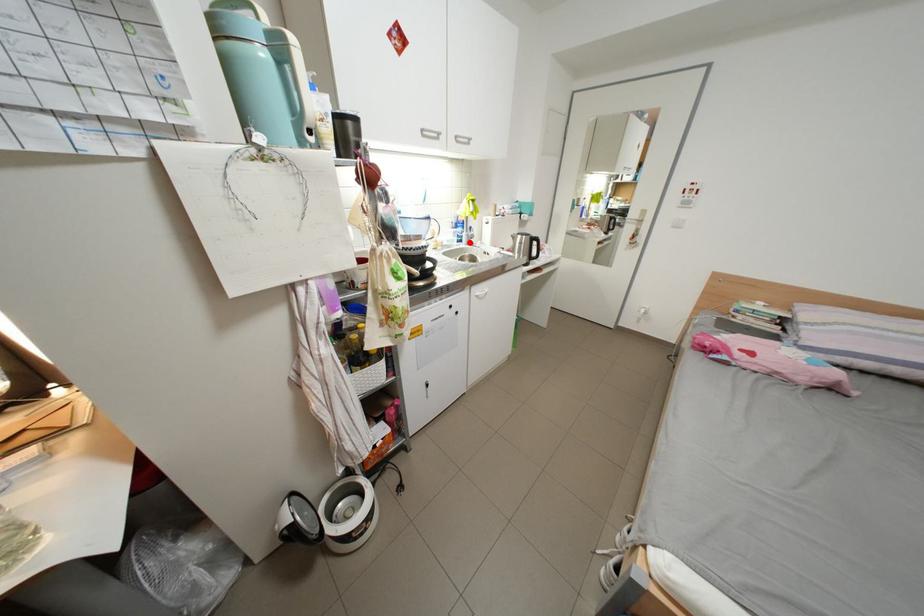
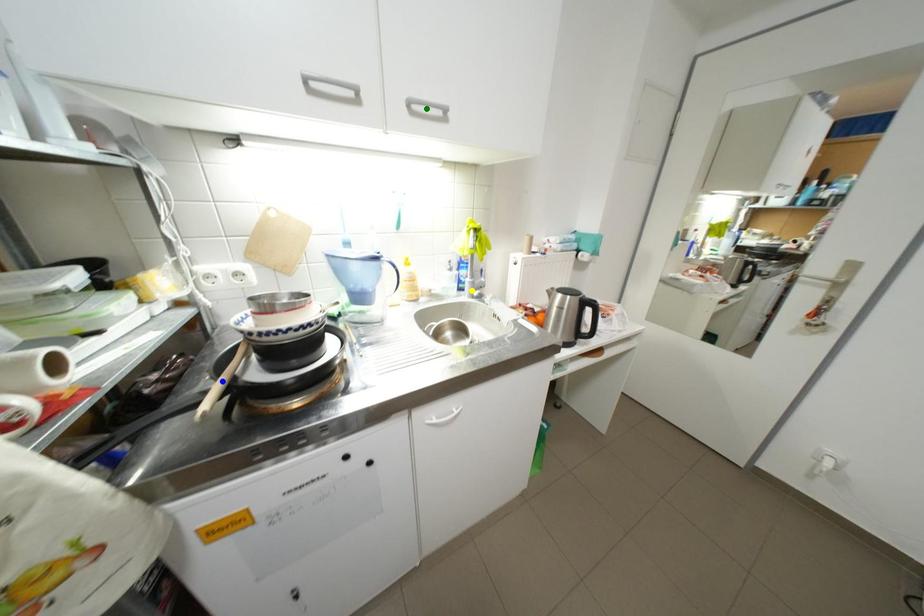
Question: I am providing you with two images of the same scene from different viewpoints. A red point is marked on the first image. You are given multiple points on the second image. Which spot in image 2 lines up with the point in image 1?

Choices:
 (A) green point
 (B) yellow point
 (C) blue point

Answer: (B)